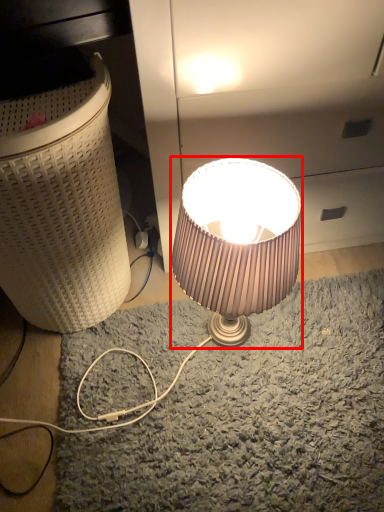
Question: Considering the relative positions of lamp (annotated by the red box) and laundry basket in the image provided, where is lamp (annotated by the red box) located with respect to the staircase?

Choices:
 (A) left
 (B) right

Answer: (B)